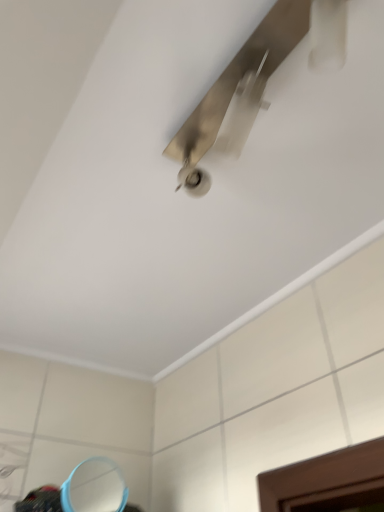
Question: From the image's perspective, is metallic silver ceiling fan at upper center on top of blue plastic mirror at lower left?

Choices:
 (A) yes
 (B) no

Answer: (A)

Question: Is the surface of metallic silver ceiling fan at upper center in direct contact with blue plastic mirror at lower left?

Choices:
 (A) yes
 (B) no

Answer: (B)

Question: Considering the relative positions of metallic silver ceiling fan at upper center and blue plastic mirror at lower left in the image provided, is metallic silver ceiling fan at upper center to the left of blue plastic mirror at lower left from the viewer's perspective?

Choices:
 (A) yes
 (B) no

Answer: (B)

Question: Is metallic silver ceiling fan at upper center smaller than blue plastic mirror at lower left?

Choices:
 (A) yes
 (B) no

Answer: (B)

Question: From a real-world perspective, is metallic silver ceiling fan at upper center under blue plastic mirror at lower left?

Choices:
 (A) no
 (B) yes

Answer: (A)

Question: Is metallic silver ceiling fan at upper center turned away from blue plastic mirror at lower left?

Choices:
 (A) no
 (B) yes

Answer: (A)

Question: Considering the relative positions of blue plastic mirror at lower left and metallic silver ceiling fan at upper center in the image provided, is blue plastic mirror at lower left to the right of metallic silver ceiling fan at upper center from the viewer's perspective?

Choices:
 (A) yes
 (B) no

Answer: (B)

Question: Are blue plastic mirror at lower left and metallic silver ceiling fan at upper center making contact?

Choices:
 (A) yes
 (B) no

Answer: (B)

Question: Is blue plastic mirror at lower left outside of metallic silver ceiling fan at upper center?

Choices:
 (A) no
 (B) yes

Answer: (B)

Question: Can you confirm if blue plastic mirror at lower left is wider than metallic silver ceiling fan at upper center?

Choices:
 (A) yes
 (B) no

Answer: (B)

Question: Is there a large distance between blue plastic mirror at lower left and metallic silver ceiling fan at upper center?

Choices:
 (A) no
 (B) yes

Answer: (B)

Question: Is blue plastic mirror at lower left oriented towards metallic silver ceiling fan at upper center?

Choices:
 (A) yes
 (B) no

Answer: (A)

Question: From the image's perspective, relative to metallic silver ceiling fan at upper center, is blue plastic mirror at lower left above or below?

Choices:
 (A) below
 (B) above

Answer: (A)